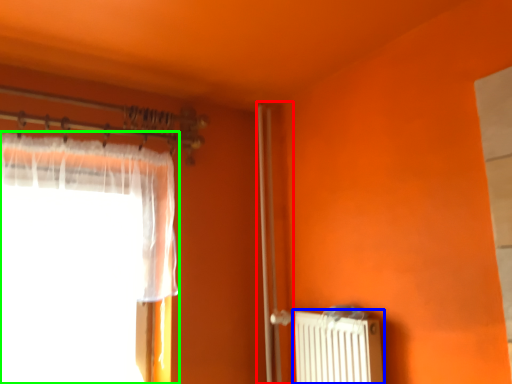
Question: Which object is the closest to the screen door (highlighted by a red box)? Choose among these: radiator (highlighted by a blue box) or curtain (highlighted by a green box).

Choices:
 (A) radiator
 (B) curtain

Answer: (A)